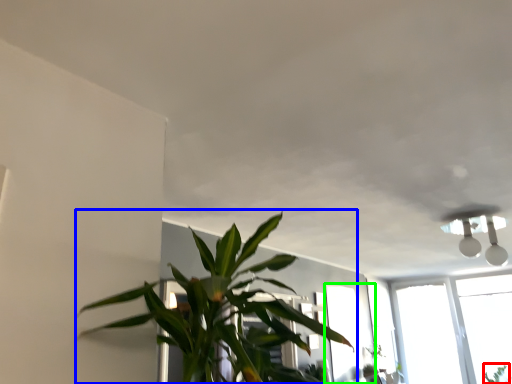
Question: Based on their relative distances, which object is nearer to plant (highlighted by a red box)? Choose from houseplant (highlighted by a blue box) and window (highlighted by a green box).

Choices:
 (A) houseplant
 (B) window

Answer: (B)